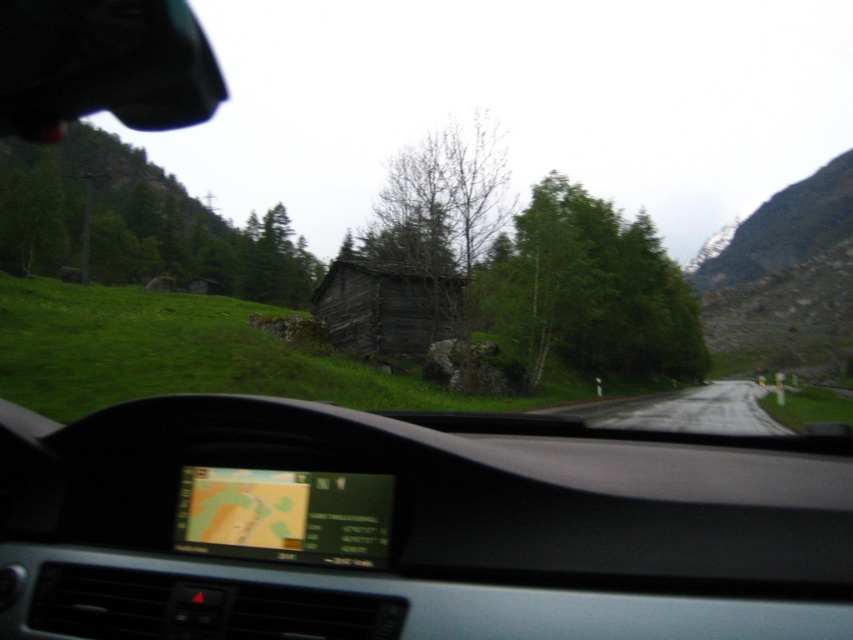
Question: Is green matte tree at center above dark brown wooden log cabin at center?

Choices:
 (A) yes
 (B) no

Answer: (A)

Question: Does transparent glass windshield at center have a smaller size compared to green matte tree at left?

Choices:
 (A) no
 (B) yes

Answer: (B)

Question: Does green matte tree at center have a larger size compared to bare wood tree at center?

Choices:
 (A) no
 (B) yes

Answer: (A)

Question: Which object is positioned farthest from the dark brown wooden log cabin at center?

Choices:
 (A) green matte tree at left
 (B) gray asphalt road at center
 (C) bare wood tree at center

Answer: (A)

Question: Which object appears farthest from the camera in this image?

Choices:
 (A) green matte tree at center
 (B) transparent glass windshield at center

Answer: (A)

Question: Which of the following is the farthest from the observer?

Choices:
 (A) (695, 419)
 (B) (456, 248)
 (C) (80, 202)
 (D) (646, 248)

Answer: (C)